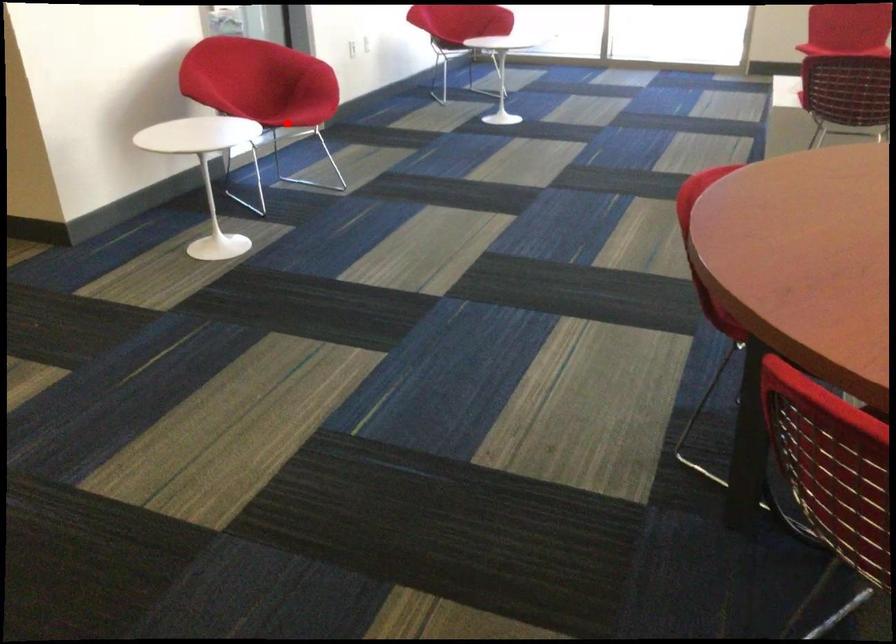
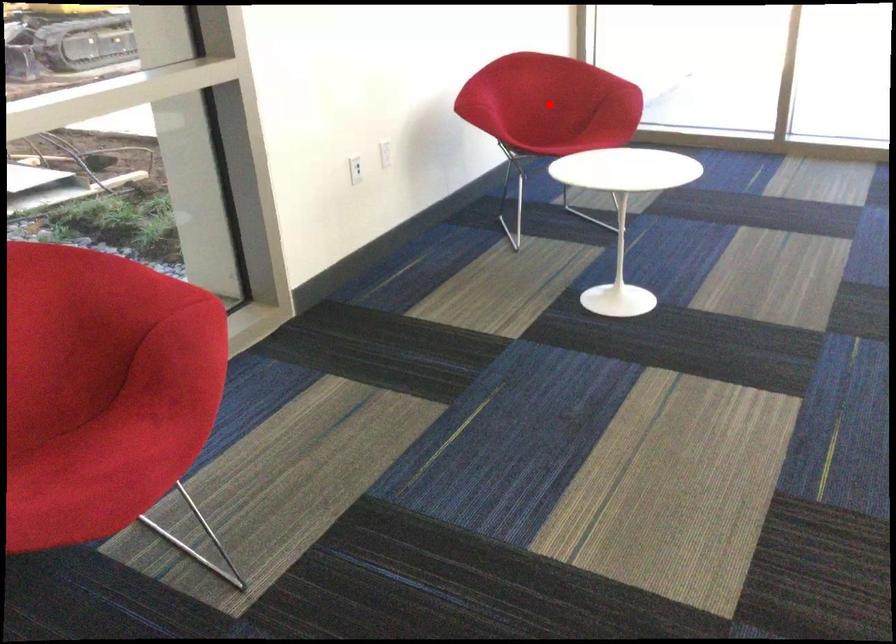
I am providing you with two images of the same scene from different viewpoints. A red point is marked on the first image and another point is marked on the second image. Is the marked point in image1 the same physical position as the marked point in image2?

No